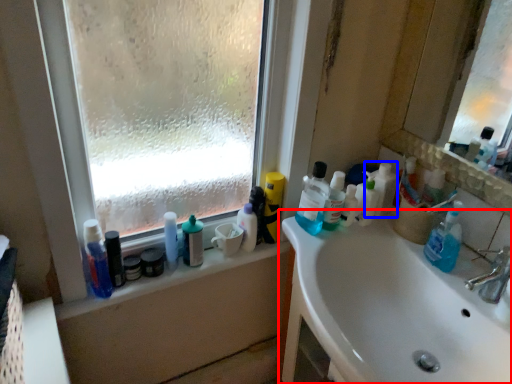
Question: Which point is further to the camera, bathroom cabinet (highlighted by a red box) or cleaning product (highlighted by a blue box)?

Choices:
 (A) bathroom cabinet
 (B) cleaning product

Answer: (B)